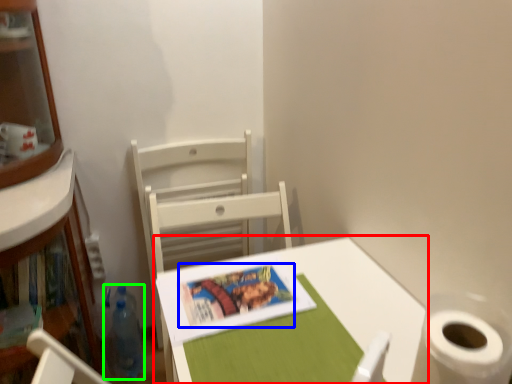
Question: Which object is the farthest from table (highlighted by a red box)? Choose among these: book cover (highlighted by a blue box) or bottle (highlighted by a green box).

Choices:
 (A) book cover
 (B) bottle

Answer: (B)